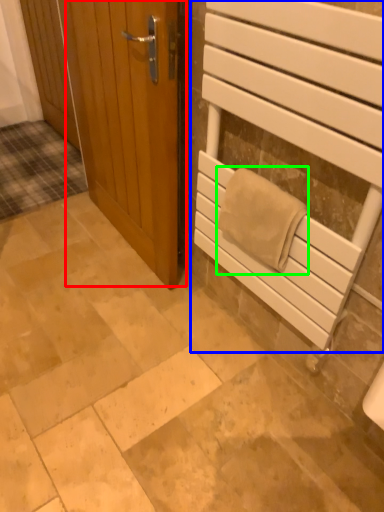
Question: Which object is positioned closest to door (highlighted by a red box)? Select from elevator (highlighted by a blue box) and bath towel (highlighted by a green box).

Choices:
 (A) elevator
 (B) bath towel

Answer: (A)